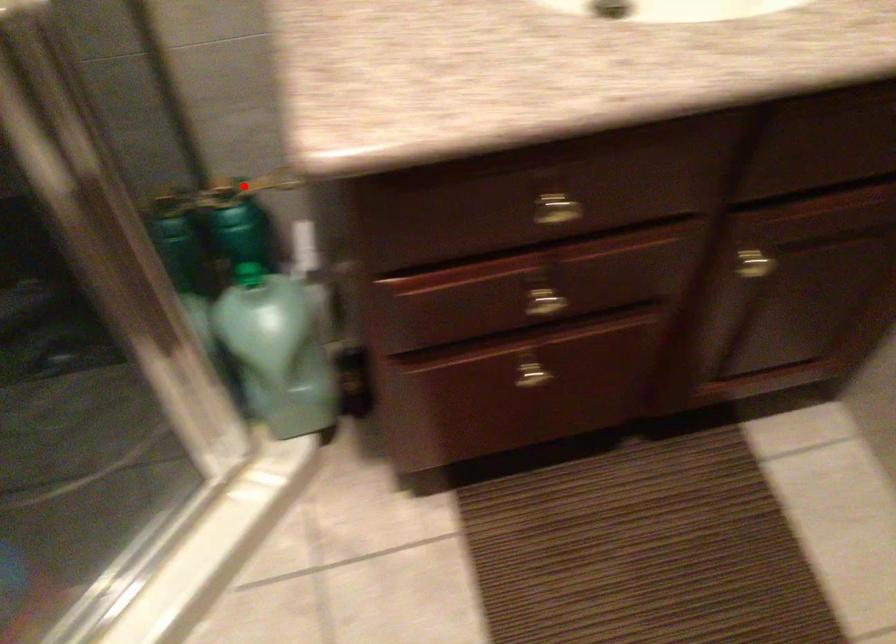
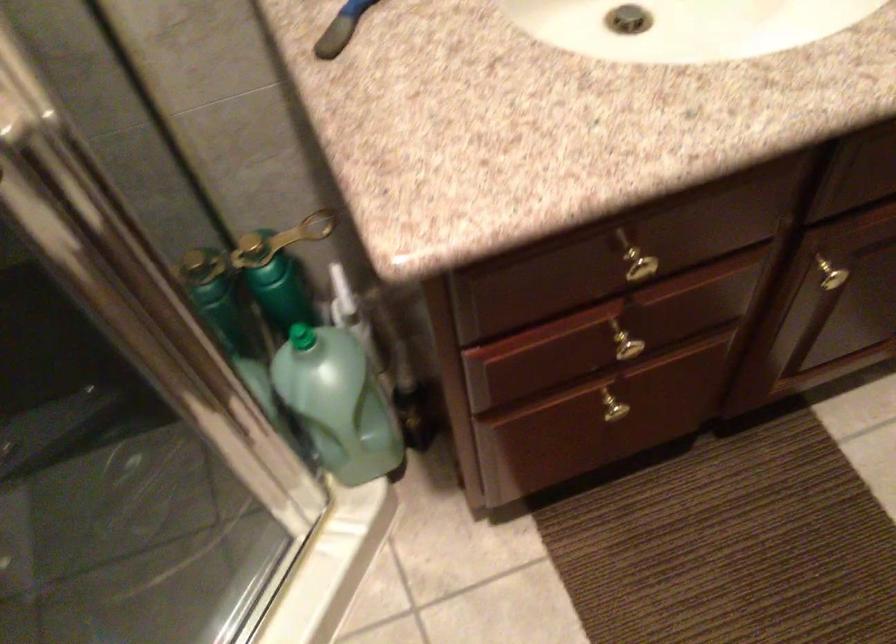
The point at the highlighted location is marked in the first image. Where is the corresponding point in the second image?

(280, 240)